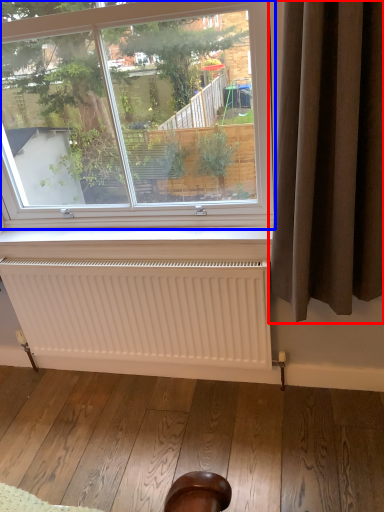
Question: Which object is further to the camera taking this photo, curtain (highlighted by a red box) or window (highlighted by a blue box)?

Choices:
 (A) curtain
 (B) window

Answer: (B)